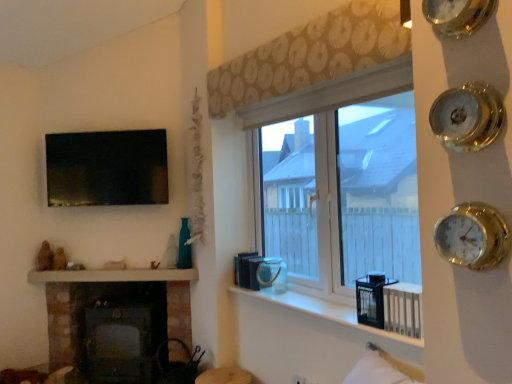
Question: From the image's perspective, is dark gray metal wood burning stove at lower left positioned above or below beige patterned curtain at upper center?

Choices:
 (A) below
 (B) above

Answer: (A)

Question: In terms of height, does dark gray metal wood burning stove at lower left look taller or shorter compared to beige patterned curtain at upper center?

Choices:
 (A) tall
 (B) short

Answer: (A)

Question: Which of these objects is positioned closest to the matte black tv at upper left?

Choices:
 (A) matte brown vase at lower center
 (B) gold metallic clock at upper right, the second clock when ordered from top to bottom
 (C) gold metallic clock at upper right, positioned as the 2th clock in bottom-to-top order
 (D) black plastic radiator at lower right
 (E) dark gray metal wood burning stove at lower left

Answer: (E)

Question: Estimate the real-world distances between objects in this image. Which object is farther from the beige patterned curtain at upper center?

Choices:
 (A) white glossy mantle at lower left
 (B) white glossy window sill at center
 (C) gold metallic clock at upper right, the second clock when ordered from top to bottom
 (D) gold metallic clock at upper right, which is the 1th clock from top to bottom
 (E) black plastic radiator at lower right

Answer: (A)